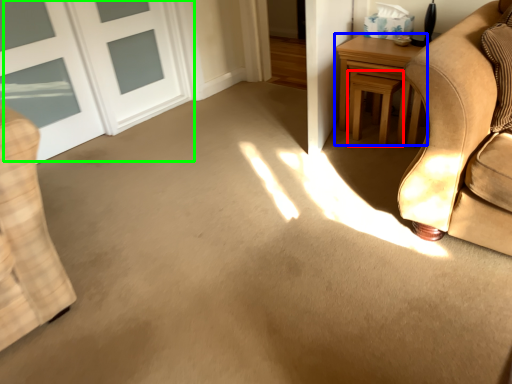
Question: Estimate the real-world distances between objects in this image. Which object is farther from stool (highlighted by a red box), table (highlighted by a blue box) or door (highlighted by a green box)?

Choices:
 (A) table
 (B) door

Answer: (B)